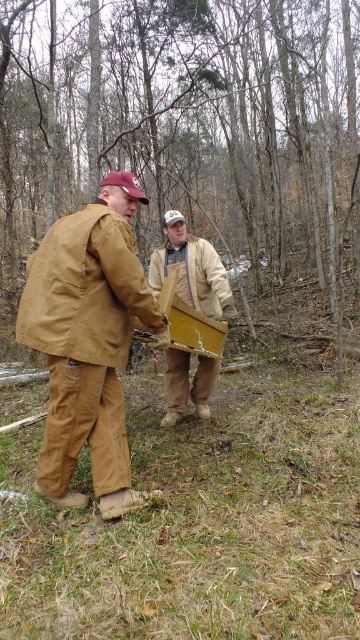
Question: Does brown canvas jacket at left have a lesser width compared to wooden crate at center?

Choices:
 (A) yes
 (B) no

Answer: (B)

Question: Does brown wood tree at center have a lesser width compared to wooden crate at center?

Choices:
 (A) no
 (B) yes

Answer: (A)

Question: In this image, where is brown wood tree at center located relative to wooden crate at center?

Choices:
 (A) left
 (B) right

Answer: (B)

Question: Which point appears farthest from the camera in this image?

Choices:
 (A) [66, 193]
 (B) [141, 499]

Answer: (A)

Question: Which of the following is the farthest from the observer?

Choices:
 (A) brown wood tree at center
 (B) wooden crate at center

Answer: (A)

Question: Which point appears farthest from the camera in this image?

Choices:
 (A) (68, 342)
 (B) (195, 266)
 (C) (81, 180)

Answer: (C)